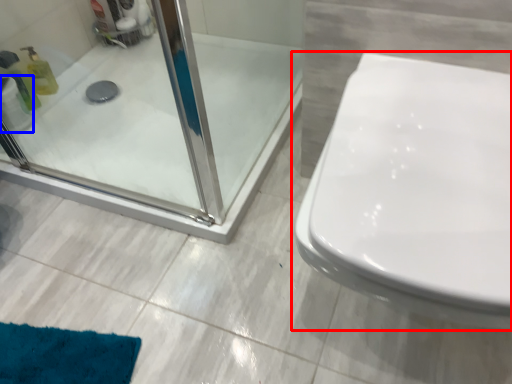
Question: Which of the following is the farthest to the observer, toilet (highlighted by a red box) or toilet paper (highlighted by a blue box)?

Choices:
 (A) toilet
 (B) toilet paper

Answer: (B)